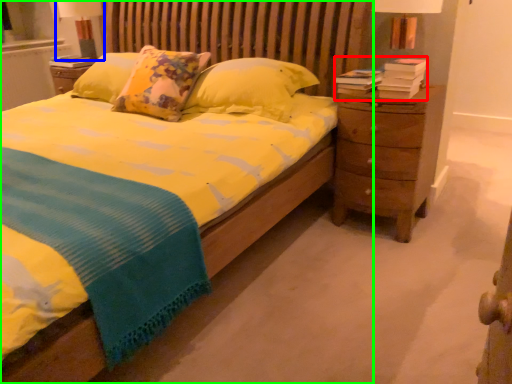
Question: Which is nearer to the book (highlighted by a red box)? bedside lamp (highlighted by a blue box) or bed (highlighted by a green box).

Choices:
 (A) bedside lamp
 (B) bed

Answer: (B)